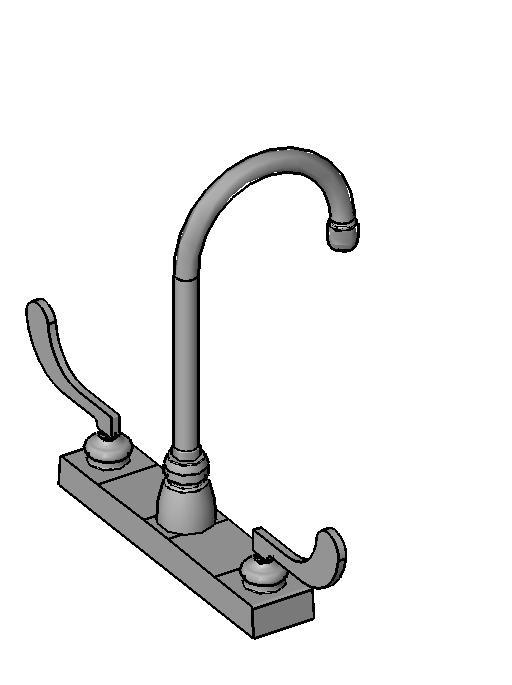
This screenshot has height=685, width=512. Find the location of `1 screw for faucet`. 1 screw for faucet is located at coordinates (200, 473).